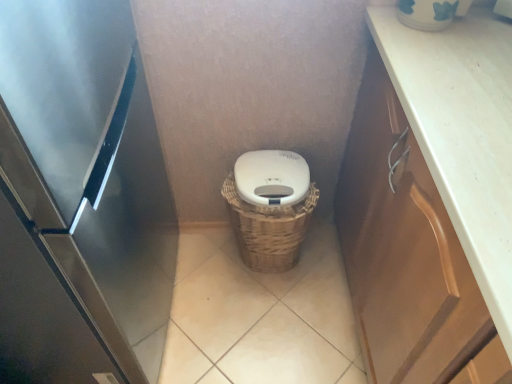
Question: Is brown wood cabinet at right far from white matte lid at center?

Choices:
 (A) no
 (B) yes

Answer: (A)

Question: Is brown wood cabinet at right oriented away from white matte lid at center?

Choices:
 (A) no
 (B) yes

Answer: (A)

Question: Does brown wood cabinet at right have a smaller size compared to white matte lid at center?

Choices:
 (A) yes
 (B) no

Answer: (B)

Question: Is brown wood cabinet at right in contact with white matte lid at center?

Choices:
 (A) yes
 (B) no

Answer: (B)

Question: Is brown wood cabinet at right at the left side of white matte lid at center?

Choices:
 (A) no
 (B) yes

Answer: (A)

Question: Does brown wood cabinet at right appear on the right side of white matte lid at center?

Choices:
 (A) yes
 (B) no

Answer: (A)

Question: Considering the relative sizes of stainless steel refrigerator at left and white matte lid at center in the image provided, is stainless steel refrigerator at left shorter than white matte lid at center?

Choices:
 (A) no
 (B) yes

Answer: (A)

Question: From the image's perspective, is stainless steel refrigerator at left under white matte lid at center?

Choices:
 (A) yes
 (B) no

Answer: (A)

Question: Is white matte lid at center surrounded by stainless steel refrigerator at left?

Choices:
 (A) yes
 (B) no

Answer: (B)

Question: Can you confirm if stainless steel refrigerator at left is thinner than white matte lid at center?

Choices:
 (A) yes
 (B) no

Answer: (B)

Question: Is stainless steel refrigerator at left looking in the opposite direction of white matte lid at center?

Choices:
 (A) yes
 (B) no

Answer: (B)

Question: Are stainless steel refrigerator at left and white matte lid at center making contact?

Choices:
 (A) no
 (B) yes

Answer: (A)

Question: Does white matte lid at center have a greater width compared to beige tile at center?

Choices:
 (A) no
 (B) yes

Answer: (A)